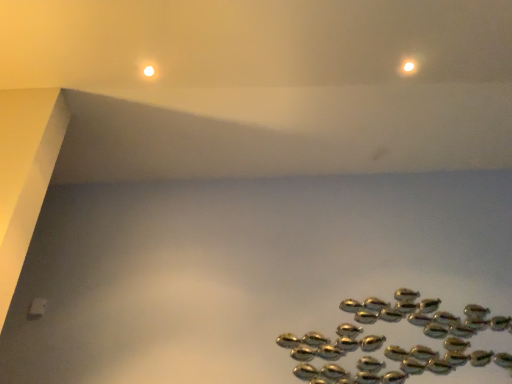
The height and width of the screenshot is (384, 512). Identify the location of metallic gold fish at lower right. (396, 345).

Measure the distance between metallic gold fish at lower right and camera.

They are 2.76 meters apart.

What do you see at coordinates (396, 345) in the screenshot?
I see `metallic gold fish at lower right` at bounding box center [396, 345].

At what (x,y) coordinates should I click in order to perform the action: click on metallic gold fish at lower right. Please return your answer as a coordinate pair (x, y). The width and height of the screenshot is (512, 384). Looking at the image, I should click on (396, 345).